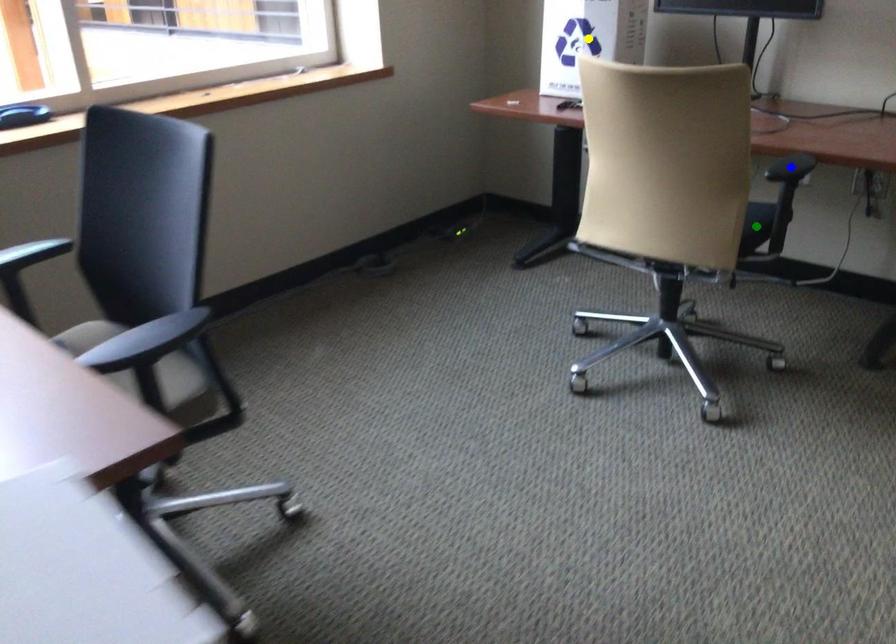
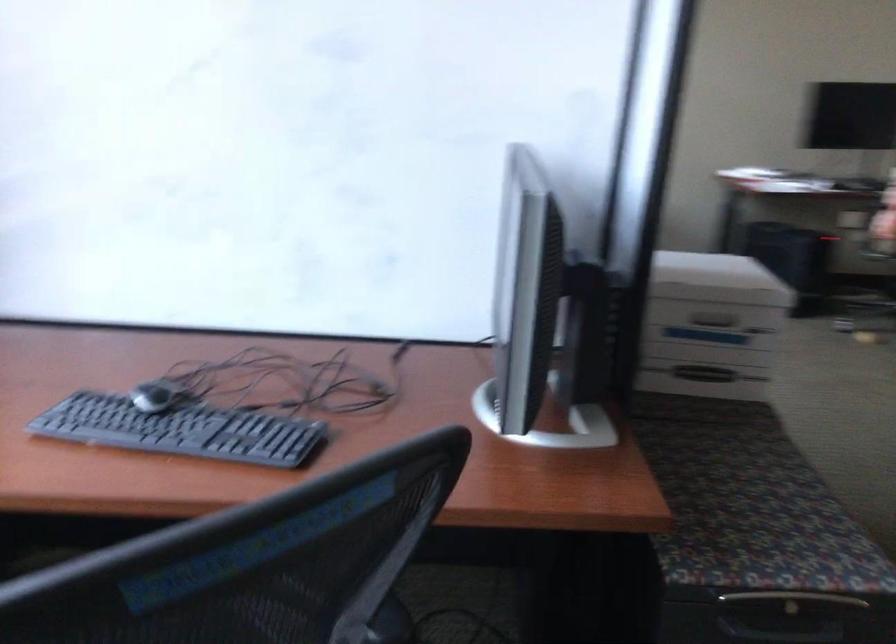
I am providing you with two images of the same scene from different viewpoints. Three points are marked in image1. Which point corresponds to a part or object that is occluded in image2?In image1, three points are marked. Which of them correspond to a part or object that is occluded in image2?Among the three points shown in image1, which one corresponds to a part or object that is no longer visible due to occlusion in image2?

Invisible in image2: yellow point, green point, blue point.